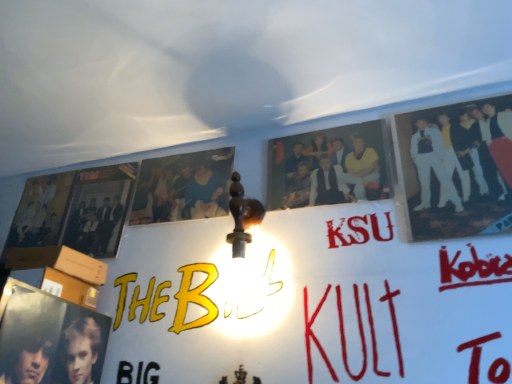
Question: Are white glossy suit at upper right, the 3th person when ordered from left to right, and matte black poster at left located far from each other?

Choices:
 (A) no
 (B) yes

Answer: (A)

Question: Is white glossy suit at upper right, the 3th person when ordered from left to right, positioned beyond the bounds of matte black poster at left?

Choices:
 (A) no
 (B) yes

Answer: (B)

Question: Can you confirm if white glossy suit at upper right, acting as the 1th person starting from the right, is taller than matte black poster at left?

Choices:
 (A) yes
 (B) no

Answer: (A)

Question: Is white glossy suit at upper right, the 3th person when ordered from left to right, closer to camera compared to matte black poster at left?

Choices:
 (A) no
 (B) yes

Answer: (B)

Question: Is matte black poster at left located within white glossy suit at upper right, the 3th person when ordered from left to right?

Choices:
 (A) no
 (B) yes

Answer: (A)

Question: From the image's perspective, is white glossy suit at upper right, acting as the 1th person starting from the right, beneath matte black poster at left?

Choices:
 (A) no
 (B) yes

Answer: (A)

Question: Considering the relative sizes of blue cotton shirt at upper center, which is the 3th person from right to left, and matte black photo at center, marked as the second person in a right-to-left arrangement, in the image provided, is blue cotton shirt at upper center, which is the 3th person from right to left, shorter than matte black photo at center, marked as the second person in a right-to-left arrangement,?

Choices:
 (A) yes
 (B) no

Answer: (B)

Question: Does blue cotton shirt at upper center, arranged as the 1th person when viewed from the left, have a lesser width compared to matte black photo at center, which is the 2th person in left-to-right order?

Choices:
 (A) yes
 (B) no

Answer: (A)

Question: Is blue cotton shirt at upper center, arranged as the 1th person when viewed from the left, wider than matte black photo at center, marked as the second person in a right-to-left arrangement?

Choices:
 (A) no
 (B) yes

Answer: (A)

Question: Considering the relative positions of blue cotton shirt at upper center, arranged as the 1th person when viewed from the left, and matte black photo at center, which is the 2th person in left-to-right order, in the image provided, is blue cotton shirt at upper center, arranged as the 1th person when viewed from the left, to the left of matte black photo at center, which is the 2th person in left-to-right order, from the viewer's perspective?

Choices:
 (A) yes
 (B) no

Answer: (A)

Question: Does blue cotton shirt at upper center, which is the 3th person from right to left, have a greater height compared to matte black photo at center, marked as the second person in a right-to-left arrangement?

Choices:
 (A) yes
 (B) no

Answer: (A)

Question: Does blue cotton shirt at upper center, arranged as the 1th person when viewed from the left, turn towards matte black photo at center, which is the 2th person in left-to-right order?

Choices:
 (A) no
 (B) yes

Answer: (A)

Question: Does matte black poster at left come in front of white glossy suit at upper right, acting as the 1th person starting from the right?

Choices:
 (A) yes
 (B) no

Answer: (B)